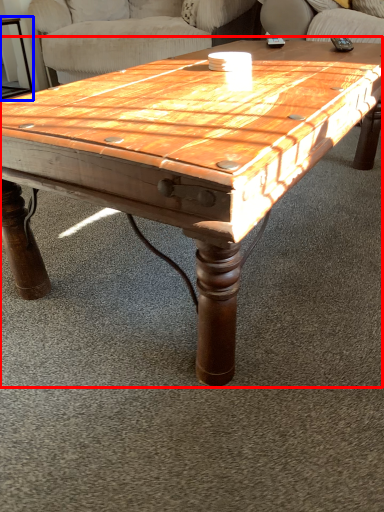
Question: Which of the following is the farthest to the observer, coffee table (highlighted by a red box) or side table (highlighted by a blue box)?

Choices:
 (A) coffee table
 (B) side table

Answer: (B)